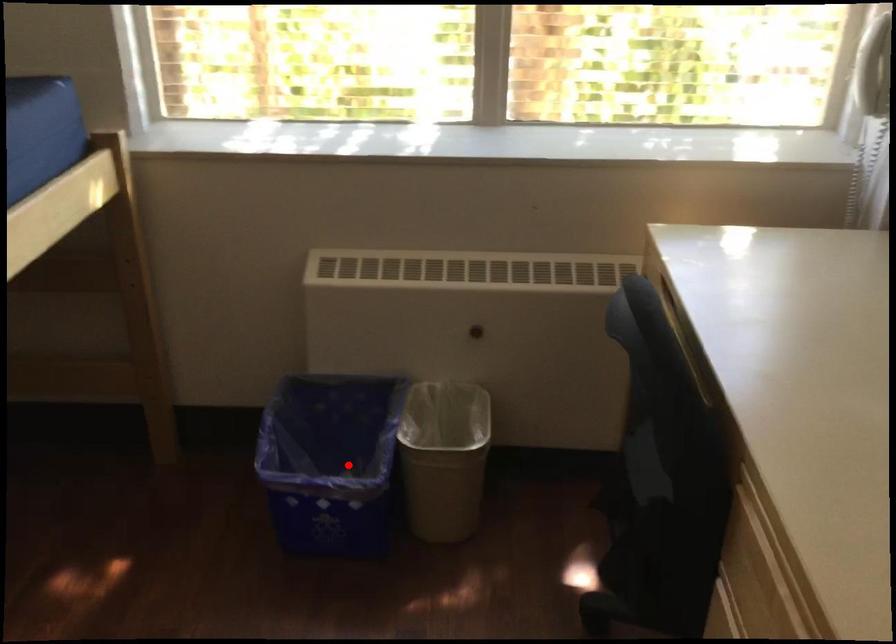
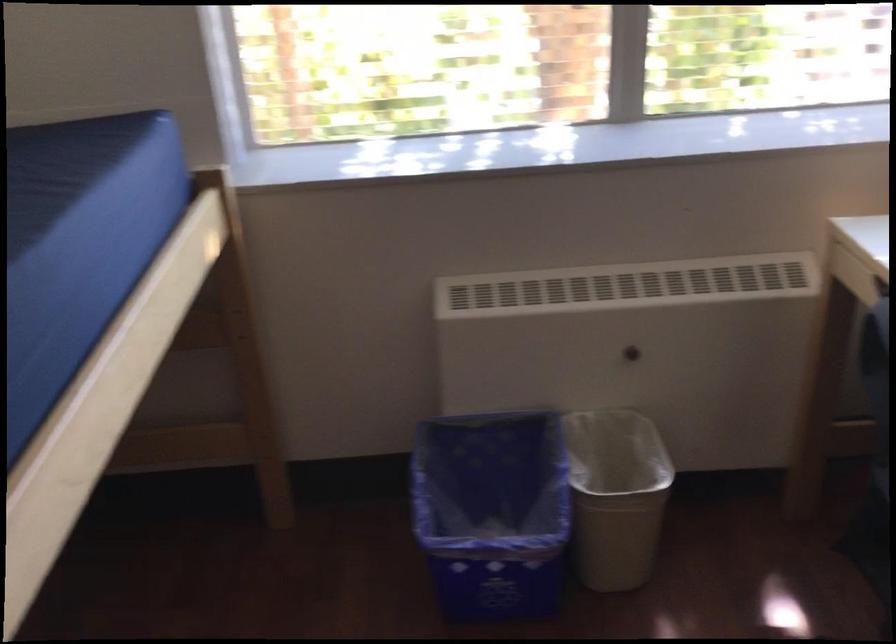
Question: I am providing you with two images of the same scene from different viewpoints. In image1, a red point is highlighted. Considering the same 3D point in image2, which of the following is correct?

Choices:
 (A) It is closer
 (B) It is farther

Answer: (A)